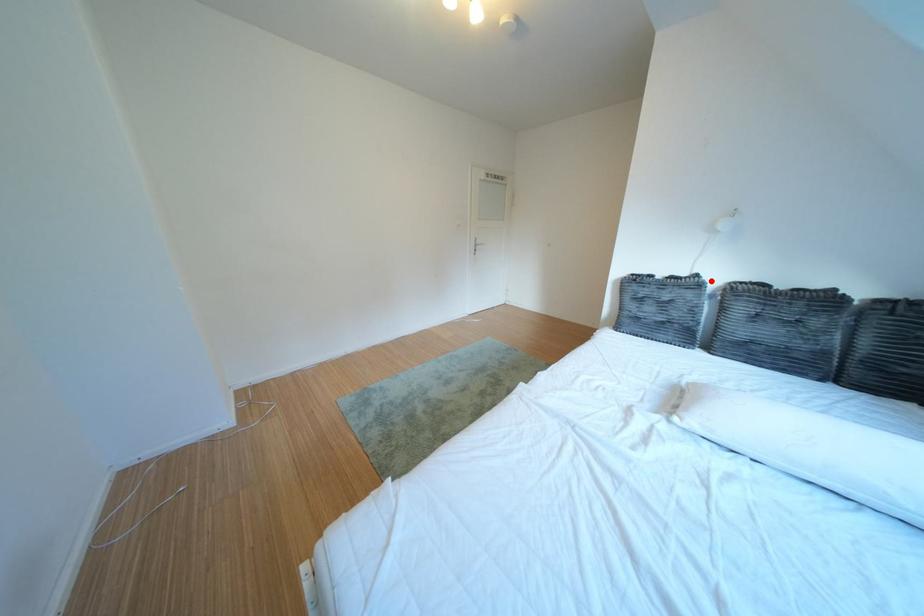
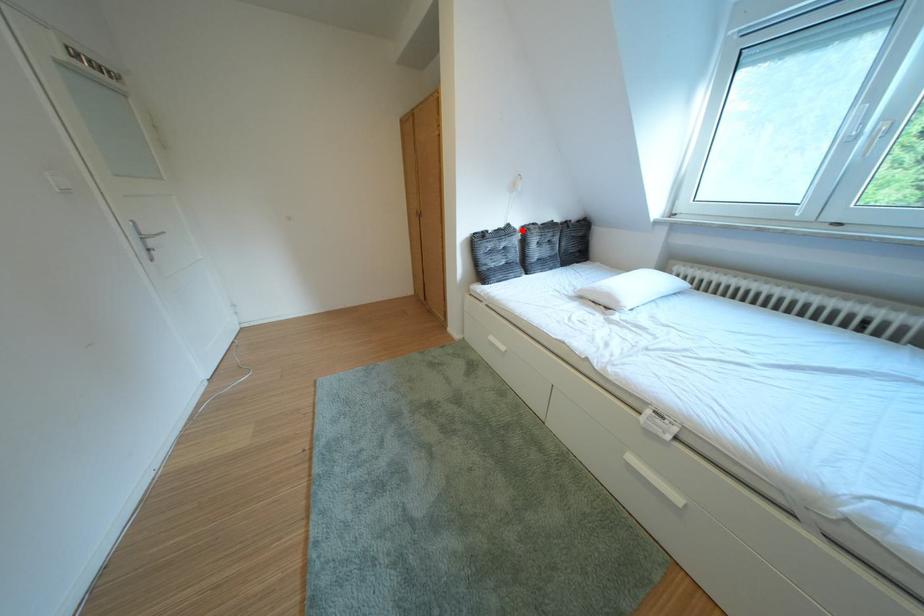
I am providing you with two images of the same scene from different viewpoints. A red point is marked on the first image and another point is marked on the second image. Is the red point in image1 aligned with the point shown in image2?

Yes